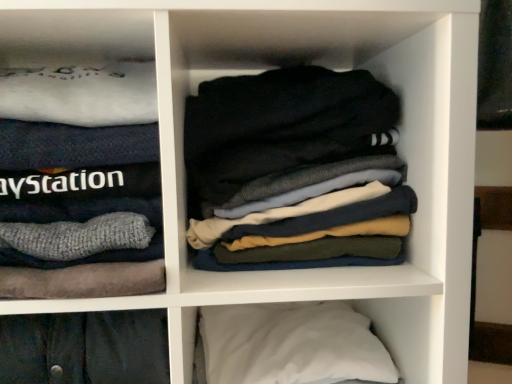
Question: Does white soft pillow at lower right appear on the left side of dark gray cotton socks at center?

Choices:
 (A) no
 (B) yes

Answer: (B)

Question: Does white soft pillow at lower right turn towards dark gray cotton socks at center?

Choices:
 (A) yes
 (B) no

Answer: (B)

Question: Considering the relative sizes of white soft pillow at lower right and dark gray cotton socks at center in the image provided, is white soft pillow at lower right taller than dark gray cotton socks at center?

Choices:
 (A) yes
 (B) no

Answer: (B)

Question: Does white soft pillow at lower right appear on the right side of dark gray cotton socks at center?

Choices:
 (A) no
 (B) yes

Answer: (A)

Question: From a real-world perspective, does white soft pillow at lower right sit lower than dark gray cotton socks at center?

Choices:
 (A) yes
 (B) no

Answer: (A)

Question: From their relative heights in the image, would you say white soft sweater at left is taller or shorter than dark gray cotton socks at center?

Choices:
 (A) tall
 (B) short

Answer: (A)

Question: From the image's perspective, is white soft sweater at left positioned above or below dark gray cotton socks at center?

Choices:
 (A) below
 (B) above

Answer: (A)

Question: Relative to dark gray cotton socks at center, is white soft sweater at left in front or behind?

Choices:
 (A) front
 (B) behind

Answer: (A)

Question: Considering the relative positions of white soft sweater at left and dark gray cotton socks at center in the image provided, is white soft sweater at left to the left or to the right of dark gray cotton socks at center?

Choices:
 (A) right
 (B) left

Answer: (B)

Question: Considering the positions of white soft pillow at lower right and dark gray cotton socks at center in the image, is white soft pillow at lower right taller or shorter than dark gray cotton socks at center?

Choices:
 (A) short
 (B) tall

Answer: (A)

Question: Relative to dark gray cotton socks at center, is white soft pillow at lower right in front or behind?

Choices:
 (A) behind
 (B) front

Answer: (B)

Question: Looking at their shapes, would you say white soft pillow at lower right is wider or thinner than dark gray cotton socks at center?

Choices:
 (A) thin
 (B) wide

Answer: (B)

Question: Would you say white soft pillow at lower right is to the left or to the right of dark gray cotton socks at center in the picture?

Choices:
 (A) left
 (B) right

Answer: (A)

Question: Looking at their shapes, would you say dark gray cotton socks at center is wider or thinner than white soft pillow at lower right?

Choices:
 (A) thin
 (B) wide

Answer: (A)

Question: From the image's perspective, is dark gray cotton socks at center located above or below white soft pillow at lower right?

Choices:
 (A) below
 (B) above

Answer: (B)